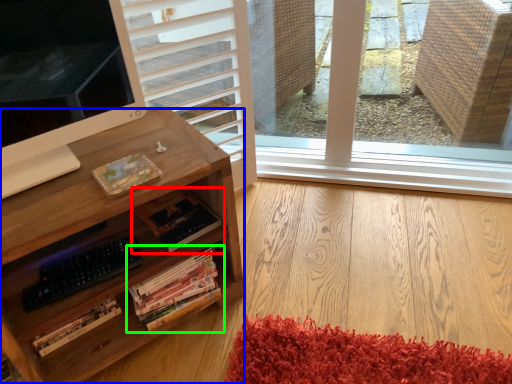
Question: Which object is positioned closest to book (highlighted by a red box)? Select from desk (highlighted by a blue box) and book (highlighted by a green box).

Choices:
 (A) desk
 (B) book

Answer: (B)